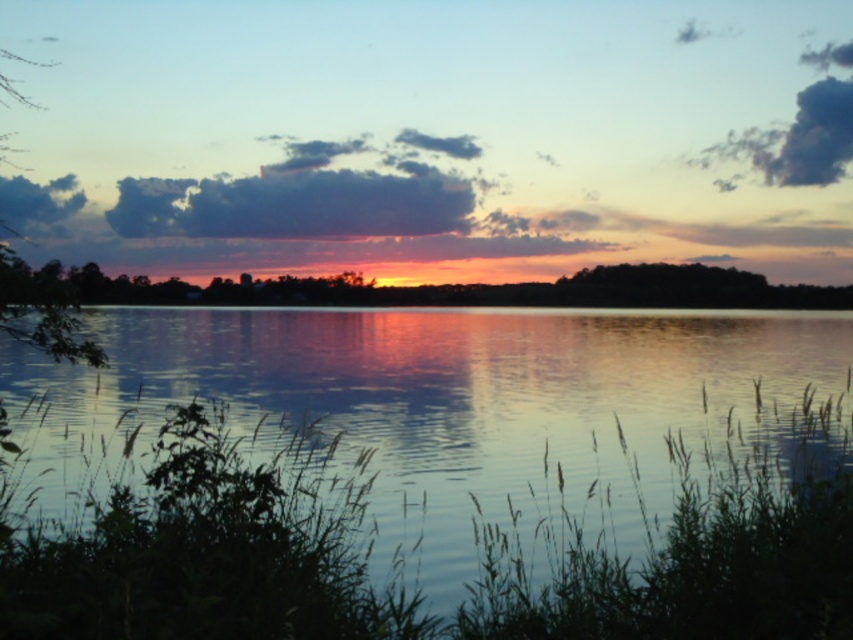
In the scene shown: You are standing on the shore of the lake and see a point marked at coordinates (444, 289) in the image. According to the scene description, what object is this point located on?

The point at (444, 289) is located on the silhouette tree at center.

You are an artist trying to paint the sunset scene. You notice the silhouette tree at center and the dark gray fluffy cloud at upper center. Which object is positioned lower in the image?

The silhouette tree at center is located below the dark gray fluffy cloud at upper center, so the silhouette tree at center is positioned lower in the image.

You are standing on the shore of the lake and want to walk from the green leafy tree at left to the blue reflective water at center. How far will you have to walk?

The blue reflective water at center is 13.71 meters away from the green leafy tree at left, so you will have to walk 13.71 meters to reach the blue reflective water at center from the green leafy tree at left.